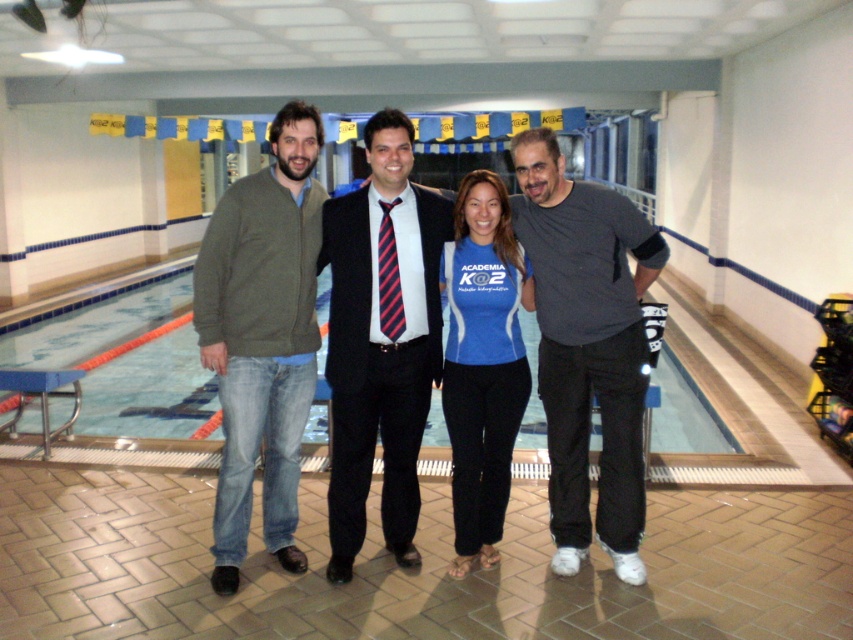
The width and height of the screenshot is (853, 640). What do you see at coordinates (587, 348) in the screenshot?
I see `dark gray sweatshirt at right` at bounding box center [587, 348].

Between dark gray sweatshirt at right and green sweater at left, which one has more height?

green sweater at left

Is point (637, 352) less distant than point (244, 515)?

Yes, it is.

Where is `dark gray sweatshirt at right`? The width and height of the screenshot is (853, 640). dark gray sweatshirt at right is located at coordinates (587, 348).

Can you confirm if black suit at center is wider than blue tile swimming pool at center?

Correct, the width of black suit at center exceeds that of blue tile swimming pool at center.

Which is in front, point (363, 332) or point (35, 364)?

Point (363, 332) is in front.

Which is behind, point (351, 518) or point (107, 337)?

The point (107, 337) is behind.

Find the location of a particular element. The image size is (853, 640). black suit at center is located at coordinates (381, 339).

Which of these two, dark gray sweatshirt at right or black suit at center, stands shorter?

dark gray sweatshirt at right is shorter.

Does dark gray sweatshirt at right have a smaller size compared to black suit at center?

Incorrect, dark gray sweatshirt at right is not smaller in size than black suit at center.

Is point (608, 449) in front of point (405, 470)?

Yes, it is in front of point (405, 470).

Identify the location of dark gray sweatshirt at right. (587, 348).